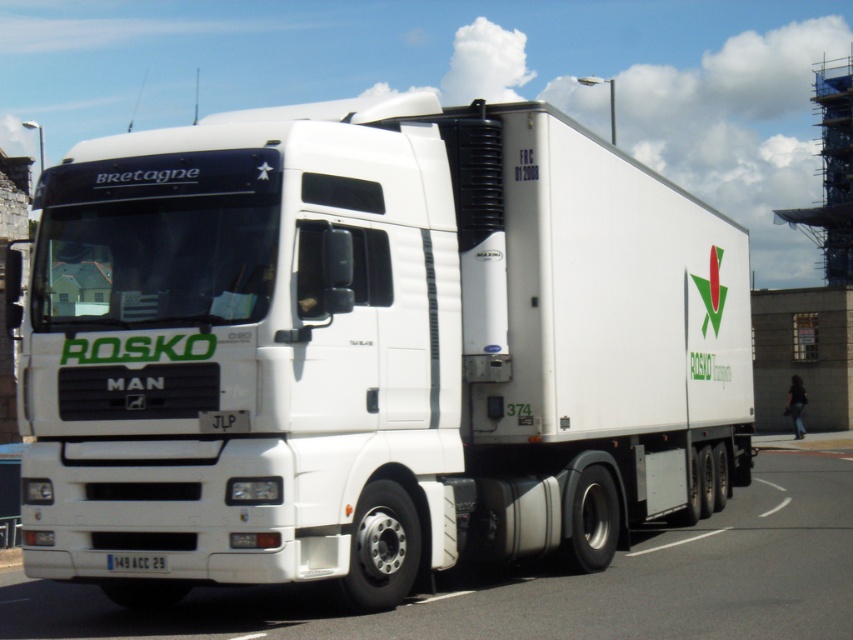
Question: Which object is positioned closest to the white glossy truck at center?

Choices:
 (A) white matte truck at center
 (B) white plastic license plate at bottom center

Answer: (A)

Question: Does white matte truck at center appear over white glossy truck at center?

Choices:
 (A) yes
 (B) no

Answer: (A)

Question: Which of these objects is positioned closest to the white matte truck at center?

Choices:
 (A) white glossy truck at center
 (B) white plastic license plate at bottom center

Answer: (A)

Question: Can you confirm if white matte truck at center is thinner than white plastic license plate at bottom center?

Choices:
 (A) no
 (B) yes

Answer: (A)

Question: Does white glossy truck at center have a lesser width compared to white plastic license plate at bottom center?

Choices:
 (A) no
 (B) yes

Answer: (A)

Question: Which is nearer to the white matte truck at center?

Choices:
 (A) white glossy truck at center
 (B) white plastic license plate at bottom center

Answer: (A)